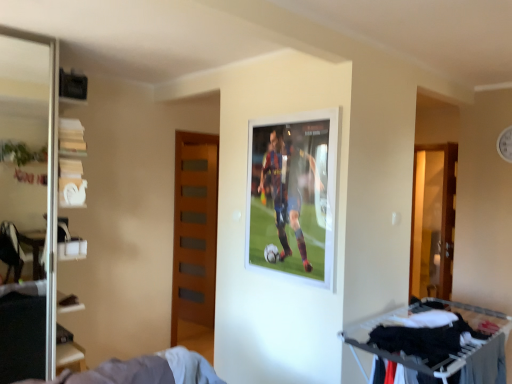
Question: Considering the relative positions of white fabric clothes rack at lower right and wooden door at center-left in the image provided, is white fabric clothes rack at lower right in front of wooden door at center-left?

Choices:
 (A) yes
 (B) no

Answer: (A)

Question: Is white fabric clothes rack at lower right to the left of wooden door at center-left from the viewer's perspective?

Choices:
 (A) no
 (B) yes

Answer: (A)

Question: Can we say white fabric clothes rack at lower right lies outside wooden door at center-left?

Choices:
 (A) no
 (B) yes

Answer: (B)

Question: From the image's perspective, is white fabric clothes rack at lower right located above wooden door at center-left?

Choices:
 (A) no
 (B) yes

Answer: (A)

Question: Does white fabric clothes rack at lower right have a greater height compared to wooden door at center-left?

Choices:
 (A) no
 (B) yes

Answer: (A)

Question: Is point (76, 206) positioned closer to the camera than point (13, 100)?

Choices:
 (A) closer
 (B) farther

Answer: (A)

Question: In the image, is white plastic shelves at left positioned in front of or behind transparent glass screen door at left?

Choices:
 (A) front
 (B) behind

Answer: (B)

Question: Based on their sizes in the image, would you say white plastic shelves at left is bigger or smaller than transparent glass screen door at left?

Choices:
 (A) big
 (B) small

Answer: (A)

Question: From a real-world perspective, is white plastic shelves at left physically located above or below transparent glass screen door at left?

Choices:
 (A) below
 (B) above

Answer: (A)

Question: From a real-world perspective, is wooden door at center-left physically located above or below white plastic shelves at left?

Choices:
 (A) below
 (B) above

Answer: (A)

Question: Considering the positions of wooden door at center-left and white plastic shelves at left in the image, is wooden door at center-left wider or thinner than white plastic shelves at left?

Choices:
 (A) wide
 (B) thin

Answer: (B)

Question: Is wooden door at center-left inside or outside of white plastic shelves at left?

Choices:
 (A) inside
 (B) outside

Answer: (B)

Question: From the image's perspective, is wooden door at center-left positioned above or below white plastic shelves at left?

Choices:
 (A) above
 (B) below

Answer: (B)

Question: From the image's perspective, is transparent glass screen door at left above or below white fabric clothes rack at lower right?

Choices:
 (A) below
 (B) above

Answer: (B)

Question: Looking at the image, does transparent glass screen door at left seem bigger or smaller compared to white fabric clothes rack at lower right?

Choices:
 (A) small
 (B) big

Answer: (B)